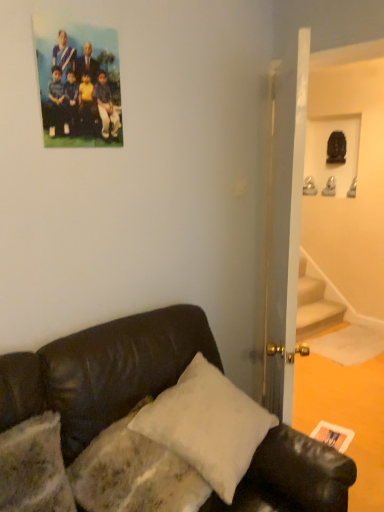
Question: Is black leather couch at lower left facing towards white soft pillow at lower center?

Choices:
 (A) no
 (B) yes

Answer: (B)

Question: Can you confirm if black leather couch at lower left is thinner than white soft pillow at lower center?

Choices:
 (A) no
 (B) yes

Answer: (A)

Question: From the image's perspective, is black leather couch at lower left located above white soft pillow at lower center?

Choices:
 (A) yes
 (B) no

Answer: (B)

Question: Considering the relative sizes of black leather couch at lower left and white soft pillow at lower center in the image provided, is black leather couch at lower left taller than white soft pillow at lower center?

Choices:
 (A) yes
 (B) no

Answer: (A)

Question: From a real-world perspective, is black leather couch at lower left positioned over white soft pillow at lower center based on gravity?

Choices:
 (A) no
 (B) yes

Answer: (A)

Question: From a real-world perspective, is black leather couch at lower left located beneath white soft pillow at lower center?

Choices:
 (A) yes
 (B) no

Answer: (A)

Question: Considering the relative positions of matte plastic photo at upper left and black leather couch at lower left in the image provided, is matte plastic photo at upper left in front of black leather couch at lower left?

Choices:
 (A) no
 (B) yes

Answer: (A)

Question: From the image's perspective, does matte plastic photo at upper left appear higher than black leather couch at lower left?

Choices:
 (A) yes
 (B) no

Answer: (A)

Question: Is matte plastic photo at upper left turned away from black leather couch at lower left?

Choices:
 (A) no
 (B) yes

Answer: (A)

Question: Is matte plastic photo at upper left aimed at black leather couch at lower left?

Choices:
 (A) no
 (B) yes

Answer: (A)

Question: Considering the relative positions of matte plastic photo at upper left and black leather couch at lower left in the image provided, is matte plastic photo at upper left to the left of black leather couch at lower left from the viewer's perspective?

Choices:
 (A) no
 (B) yes

Answer: (B)

Question: From the image's perspective, is matte plastic photo at upper left under black leather couch at lower left?

Choices:
 (A) no
 (B) yes

Answer: (A)

Question: Considering the relative positions of matte plastic photo at upper left and white matte postcard at lower right in the image provided, is matte plastic photo at upper left to the left of white matte postcard at lower right from the viewer's perspective?

Choices:
 (A) no
 (B) yes

Answer: (B)